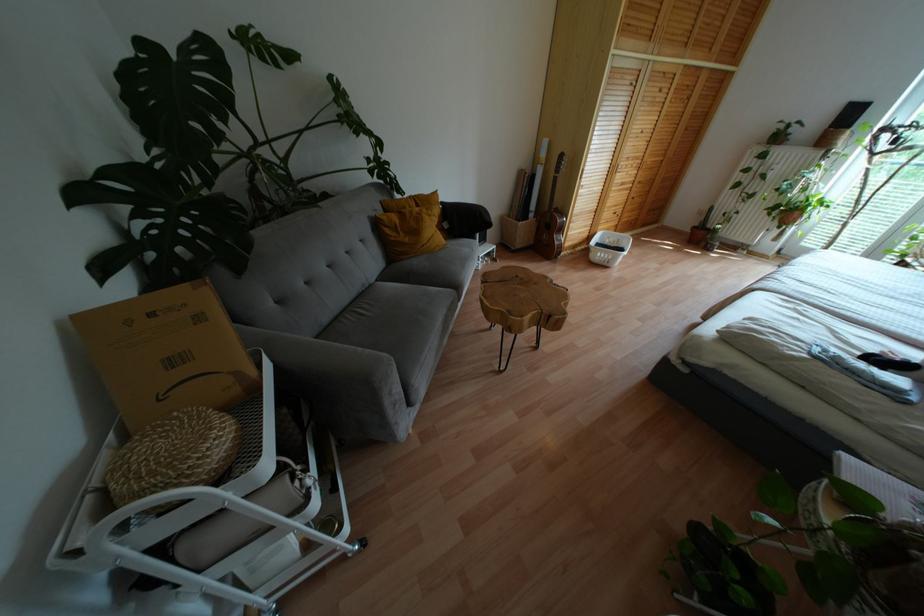
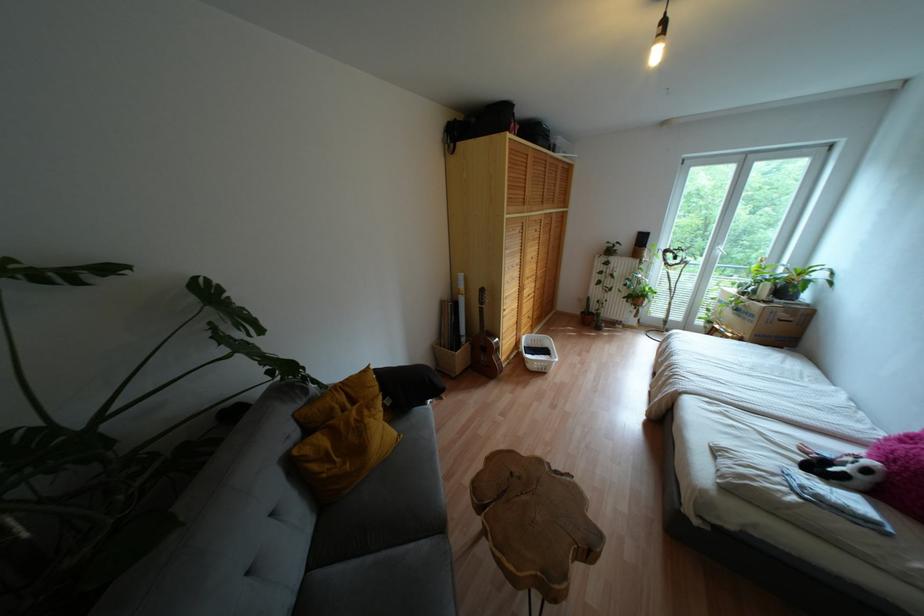
Where in the second image is the point corresponding to the point at 746,225 from the first image?

(614, 309)